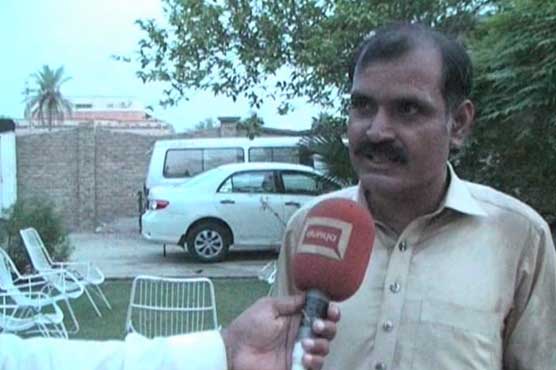
This screenshot has height=370, width=556. Identify the location of brick wall. (47, 170), (120, 168).